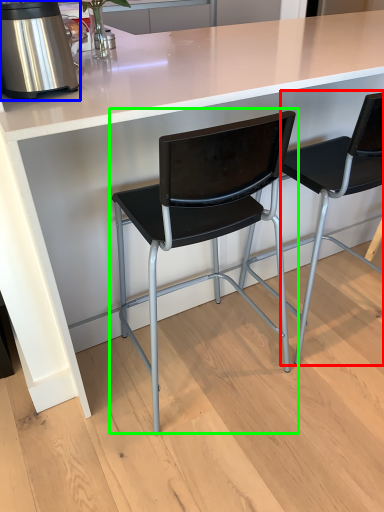
Question: Which object is the closest to the chair (highlighted by a red box)? Choose among these: kitchen appliance (highlighted by a blue box) or chair (highlighted by a green box).

Choices:
 (A) kitchen appliance
 (B) chair

Answer: (B)